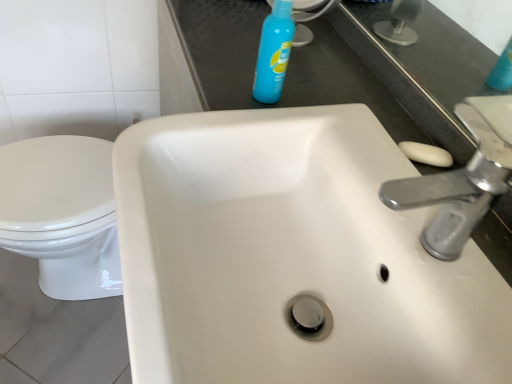
What do you see at coordinates (273, 53) in the screenshot?
I see `blue plastic spray bottle at upper center` at bounding box center [273, 53].

Locate an element on the screen. white ceramic sink at center is located at coordinates (292, 256).

Measure the distance between point [246,228] and camera.

The depth of point [246,228] is 23.74 inches.

The image size is (512, 384). I want to click on white glossy toilet at lower left, so click(x=62, y=213).

From the image's perspective, which object appears higher, white ceramic sink at center or white glossy toilet at lower left?

white ceramic sink at center is shown above in the image.

Is white ceramic sink at center positioned with its back to white glossy toilet at lower left?

No, white ceramic sink at center's orientation is not away from white glossy toilet at lower left.

Choose the correct answer: Is white ceramic sink at center inside white glossy toilet at lower left or outside it?

white ceramic sink at center cannot be found inside white glossy toilet at lower left.

Image resolution: width=512 pixels, height=384 pixels. I want to click on bidet behind the white ceramic sink at center, so click(x=62, y=213).

Identify the location of sink on the right of blue plastic spray bottle at upper center. The height and width of the screenshot is (384, 512). coord(292,256).

From a real-world perspective, is white ceramic sink at center physically located above or below blue plastic spray bottle at upper center?

Clearly, from a real-world perspective, white ceramic sink at center is below blue plastic spray bottle at upper center.

In terms of size, does white ceramic sink at center appear bigger or smaller than blue plastic spray bottle at upper center?

Clearly, white ceramic sink at center is larger in size than blue plastic spray bottle at upper center.

Which is correct: white ceramic sink at center is inside blue plastic spray bottle at upper center, or outside of it?

The correct answer is: outside.

Is white glossy toilet at lower left wider or thinner than blue plastic spray bottle at upper center?

Considering their sizes, white glossy toilet at lower left looks broader than blue plastic spray bottle at upper center.

Are white glossy toilet at lower left and blue plastic spray bottle at upper center located far from each other?

No, there isn't a large distance between white glossy toilet at lower left and blue plastic spray bottle at upper center.

Is white glossy toilet at lower left inside the boundaries of blue plastic spray bottle at upper center, or outside?

white glossy toilet at lower left cannot be found inside blue plastic spray bottle at upper center.

Is white glossy toilet at lower left turned away from silver metallic faucet at upper right?

That's not correct — white glossy toilet at lower left is not looking away from silver metallic faucet at upper right.

Between point (88, 195) and point (493, 116), which one is positioned behind?

Positioned behind is point (88, 195).

Is white glossy toilet at lower left inside or outside of silver metallic faucet at upper right?

The correct answer is: outside.

From the image's perspective, is white glossy toilet at lower left positioned above or below silver metallic faucet at upper right?

From the image's perspective, white glossy toilet at lower left appears below silver metallic faucet at upper right.

Considering the relative positions of blue plastic spray bottle at upper center and white ceramic sink at center in the image provided, is blue plastic spray bottle at upper center to the right of white ceramic sink at center from the viewer's perspective?

In fact, blue plastic spray bottle at upper center is to the left of white ceramic sink at center.

Is blue plastic spray bottle at upper center in front of or behind white ceramic sink at center in the image?

blue plastic spray bottle at upper center is positioned farther from the viewer than white ceramic sink at center.

Locate an element on the screen. This screenshot has width=512, height=384. cleaning product on the left of the white ceramic sink at center is located at coordinates click(273, 53).

Is silver metallic faucet at upper right directly adjacent to blue plastic spray bottle at upper center?

No, silver metallic faucet at upper right is not next to blue plastic spray bottle at upper center.

Considering the sizes of objects silver metallic faucet at upper right and blue plastic spray bottle at upper center in the image provided, who is wider, silver metallic faucet at upper right or blue plastic spray bottle at upper center?

silver metallic faucet at upper right.

How far apart are silver metallic faucet at upper right and blue plastic spray bottle at upper center?

The distance of silver metallic faucet at upper right from blue plastic spray bottle at upper center is 14.72 inches.

From a real-world perspective, between silver metallic faucet at upper right and blue plastic spray bottle at upper center, who is vertically higher?

silver metallic faucet at upper right.

Considering the sizes of objects white glossy toilet at lower left and white ceramic sink at center in the image provided, who is wider, white glossy toilet at lower left or white ceramic sink at center?

With larger width is white ceramic sink at center.

Considering the relative sizes of white glossy toilet at lower left and white ceramic sink at center in the image provided, is white glossy toilet at lower left shorter than white ceramic sink at center?

In fact, white glossy toilet at lower left may be taller than white ceramic sink at center.

Between point (35, 257) and point (431, 352), which one is positioned in front?

Positioned in front is point (431, 352).

Is white glossy toilet at lower left oriented away from white ceramic sink at center?

white glossy toilet at lower left does not have its back to white ceramic sink at center.

This screenshot has width=512, height=384. Find the location of `bidet behind the white ceramic sink at center`. bidet behind the white ceramic sink at center is located at coordinates (62, 213).

Where is `sink in front of the blue plastic spray bottle at upper center`? sink in front of the blue plastic spray bottle at upper center is located at coordinates (292, 256).

Looking at this image, estimate the real-world distances between objects in this image. Which object is closer to blue plastic spray bottle at upper center, white glossy toilet at lower left or silver metallic faucet at upper right?

silver metallic faucet at upper right lies closer to blue plastic spray bottle at upper center than the other object.

Based on their spatial positions, is silver metallic faucet at upper right or blue plastic spray bottle at upper center closer to white glossy toilet at lower left?

blue plastic spray bottle at upper center is positioned closer to the anchor white glossy toilet at lower left.

Estimate the real-world distances between objects in this image. Which object is closer to white glossy toilet at lower left, white ceramic sink at center or blue plastic spray bottle at upper center?

Among the two, white ceramic sink at center is located nearer to white glossy toilet at lower left.

Looking at the image, which one is located further to blue plastic spray bottle at upper center, silver metallic faucet at upper right or white glossy toilet at lower left?

white glossy toilet at lower left.

Based on their spatial positions, is blue plastic spray bottle at upper center or white ceramic sink at center closer to silver metallic faucet at upper right?

Among the two, white ceramic sink at center is located nearer to silver metallic faucet at upper right.

Estimate the real-world distances between objects in this image. Which object is further from blue plastic spray bottle at upper center, white ceramic sink at center or silver metallic faucet at upper right?

Based on the image, silver metallic faucet at upper right appears to be further to blue plastic spray bottle at upper center.

Based on their spatial positions, is blue plastic spray bottle at upper center or silver metallic faucet at upper right further from white ceramic sink at center?

blue plastic spray bottle at upper center is positioned further to the anchor white ceramic sink at center.

Estimate the real-world distances between objects in this image. Which object is further from silver metallic faucet at upper right, white ceramic sink at center or blue plastic spray bottle at upper center?

blue plastic spray bottle at upper center.

Where is `tap between blue plastic spray bottle at upper center and white ceramic sink at center from top to bottom`? This screenshot has width=512, height=384. tap between blue plastic spray bottle at upper center and white ceramic sink at center from top to bottom is located at coordinates (457, 188).

Find the location of a particular element. cleaning product located between white glossy toilet at lower left and silver metallic faucet at upper right in the left-right direction is located at coordinates (273, 53).

Find the location of a particular element. This screenshot has height=384, width=512. cleaning product situated between white glossy toilet at lower left and white ceramic sink at center from left to right is located at coordinates (273, 53).

At what (x,y) coordinates should I click in order to perform the action: click on sink between white glossy toilet at lower left and silver metallic faucet at upper right. Please return your answer as a coordinate pair (x, y). This screenshot has height=384, width=512. Looking at the image, I should click on (292, 256).